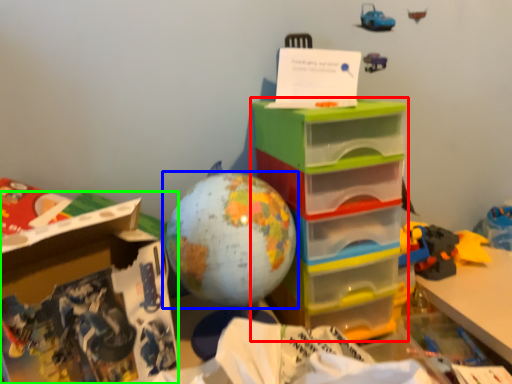
Question: Which object is positioned closest to storage box (highlighted by a red box)? Select from toy (highlighted by a blue box) and cardboard box (highlighted by a green box).

Choices:
 (A) toy
 (B) cardboard box

Answer: (A)